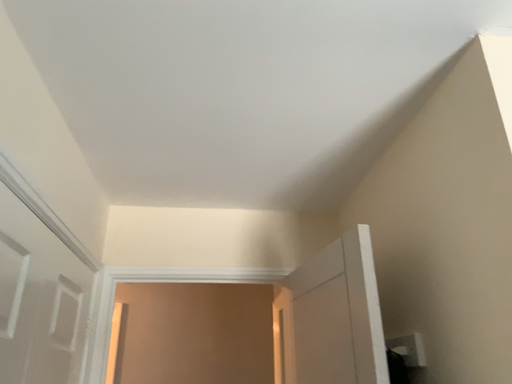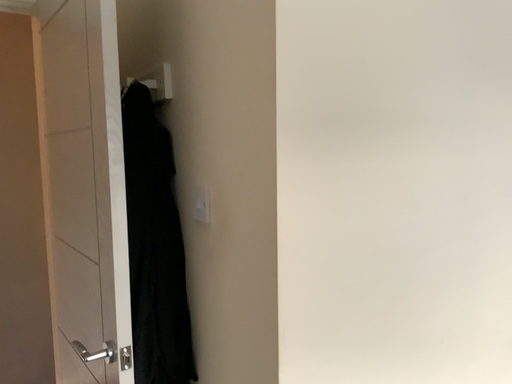
Question: Which way did the camera rotate in the video?

Choices:
 (A) rotated right
 (B) rotated left

Answer: (A)